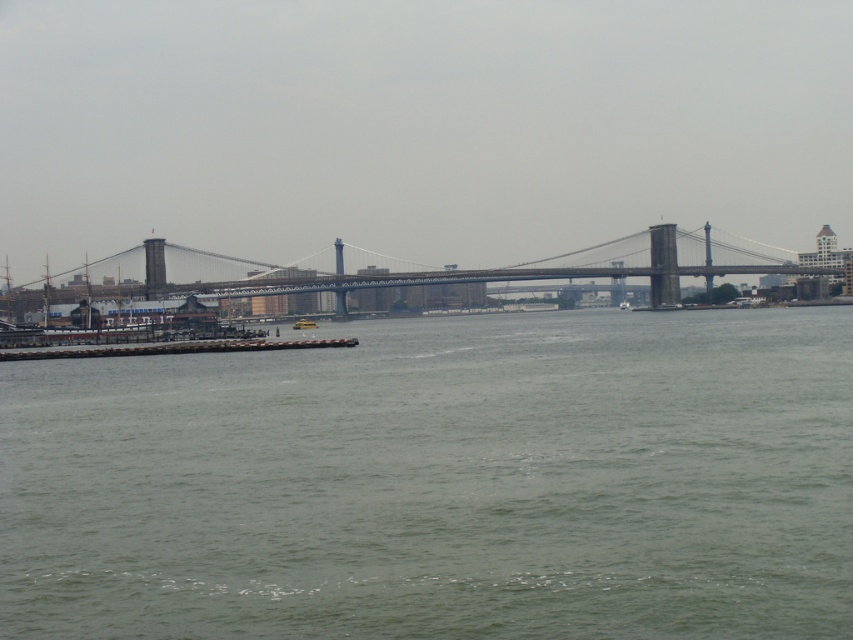
Does green water at lower center have a smaller size compared to metallic gray bridge at center?

Yes, green water at lower center is smaller than metallic gray bridge at center.

Can you confirm if green water at lower center is shorter than metallic gray bridge at center?

Correct, green water at lower center is not as tall as metallic gray bridge at center.

What are the coordinates of `green water at lower center` in the screenshot? It's located at (440, 483).

Measure the distance from metallic gray bridge at center to yellow plastic boat at center.

metallic gray bridge at center is 130.60 feet from yellow plastic boat at center.

Between metallic gray bridge at center and yellow plastic boat at center, which one is positioned higher?

metallic gray bridge at center is above.

Measure the distance between metallic gray bridge at center and camera.

metallic gray bridge at center and camera are 225.95 meters apart.

Locate an element on the screen. metallic gray bridge at center is located at coordinates (508, 273).

Does green water at lower center have a greater height compared to yellow plastic boat at center?

Indeed, green water at lower center has a greater height compared to yellow plastic boat at center.

Locate an element on the screen. This screenshot has width=853, height=640. green water at lower center is located at coordinates (440, 483).